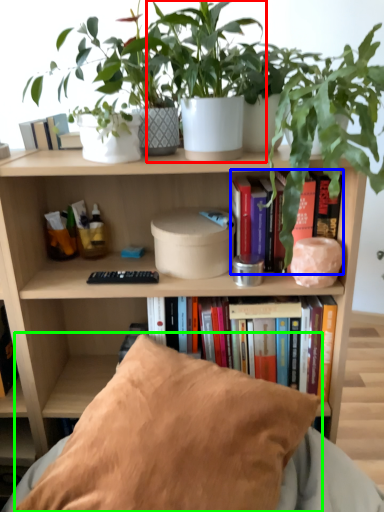
Question: Which is farther away from houseplant (highlighted by a red box)? book (highlighted by a blue box) or pillow (highlighted by a green box)?

Choices:
 (A) book
 (B) pillow

Answer: (B)